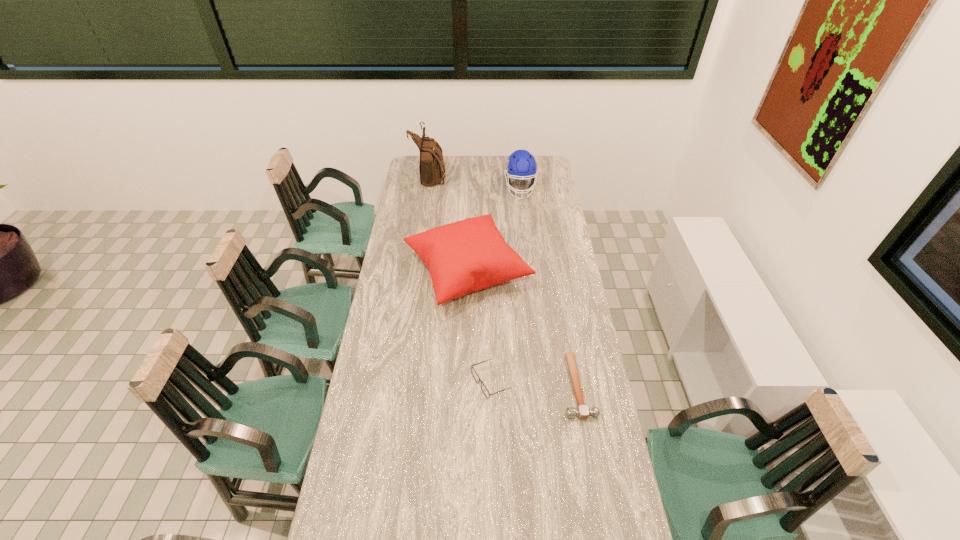
Identify the location of vacant position at the left edge of the desktop. This screenshot has height=540, width=960. (399, 311).

Find the location of a particular element. This screenshot has width=960, height=540. free space at the right edge of the desktop is located at coordinates (536, 257).

You are a GUI agent. You are given a task and a screenshot of the screen. Output one action in this format:
    pyautogui.click(x=<x>, y=<y>)
    Task: Click on the vacant area at the far left corner of the desktop
    
    Given the screenshot: What is the action you would take?
    pyautogui.click(x=410, y=176)

Identify the location of blank space at the far right corner. (541, 172).

This screenshot has height=540, width=960. I want to click on vacant area that lies between the spectacles and the shortest object, so click(x=534, y=384).

Locate an element on the screen. This screenshot has width=960, height=540. free spot between the third nearest object and the shortest object is located at coordinates (522, 329).

Where is `free space between the second shortest object and the shortest object`? free space between the second shortest object and the shortest object is located at coordinates (534, 384).

Locate an element on the screen. The width and height of the screenshot is (960, 540). vacant space in between the fourth tallest object and the third farthest object is located at coordinates (479, 327).

Locate an element on the screen. This screenshot has width=960, height=540. free space that is in between the hammer and the football helmet is located at coordinates (549, 287).

Locate an element on the screen. The image size is (960, 540). empty location between the hammer and the spectacles is located at coordinates (534, 384).